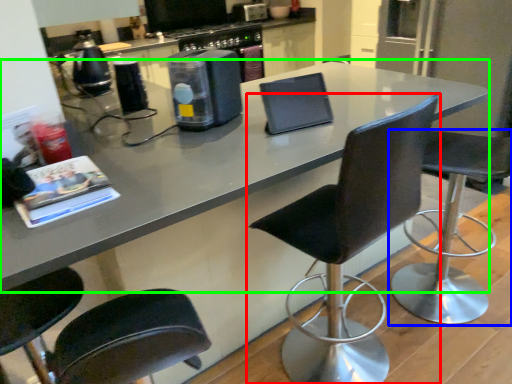
Question: Considering the real-world distances, which object is closest to chair (highlighted by a red box)? chair (highlighted by a blue box) or countertop (highlighted by a green box).

Choices:
 (A) chair
 (B) countertop

Answer: (B)